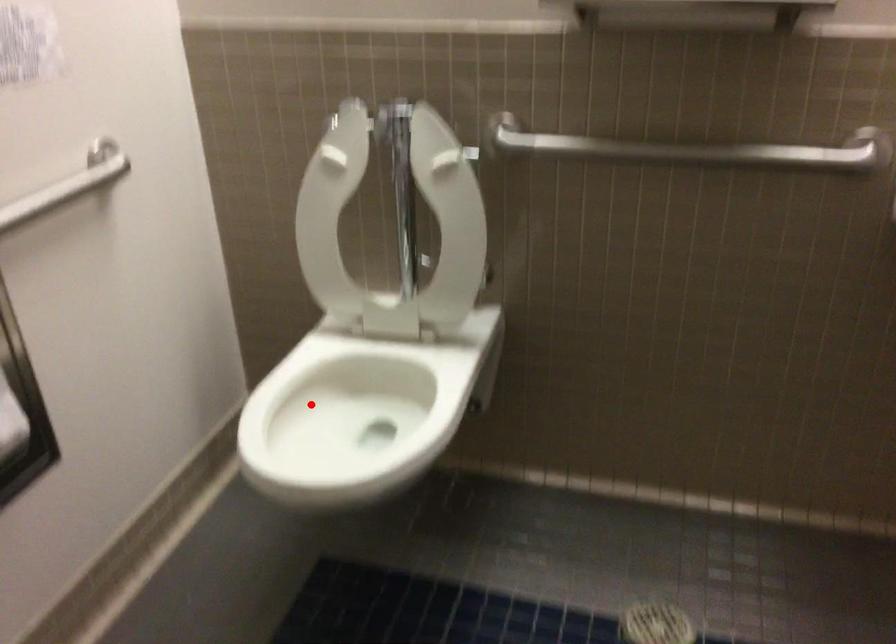
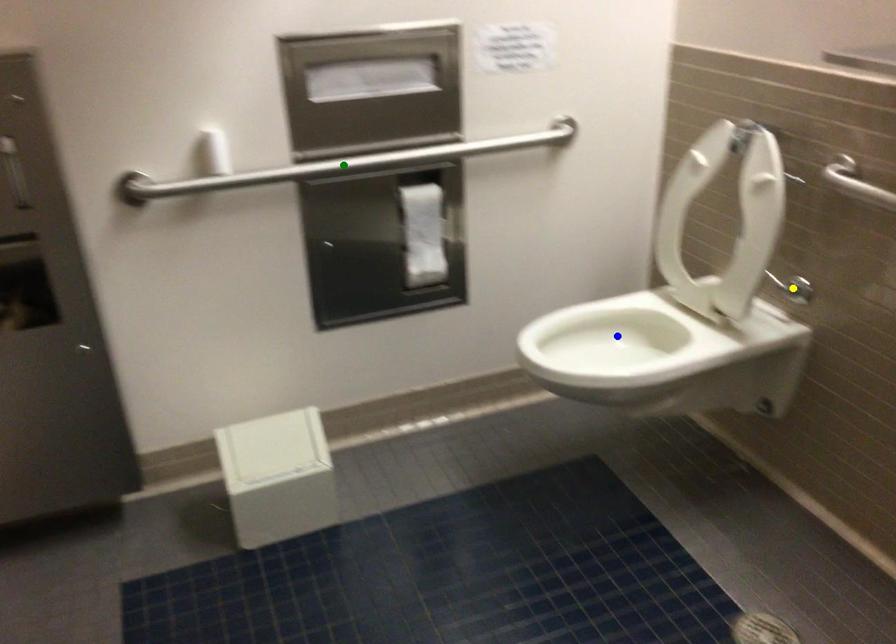
Question: I am providing you with two images of the same scene from different viewpoints. A red point is marked on the first image. You are given multiple points on the second image. In image 2, which mark is for the same physical point as the one in image 1?

Choices:
 (A) blue point
 (B) green point
 (C) yellow point

Answer: (A)